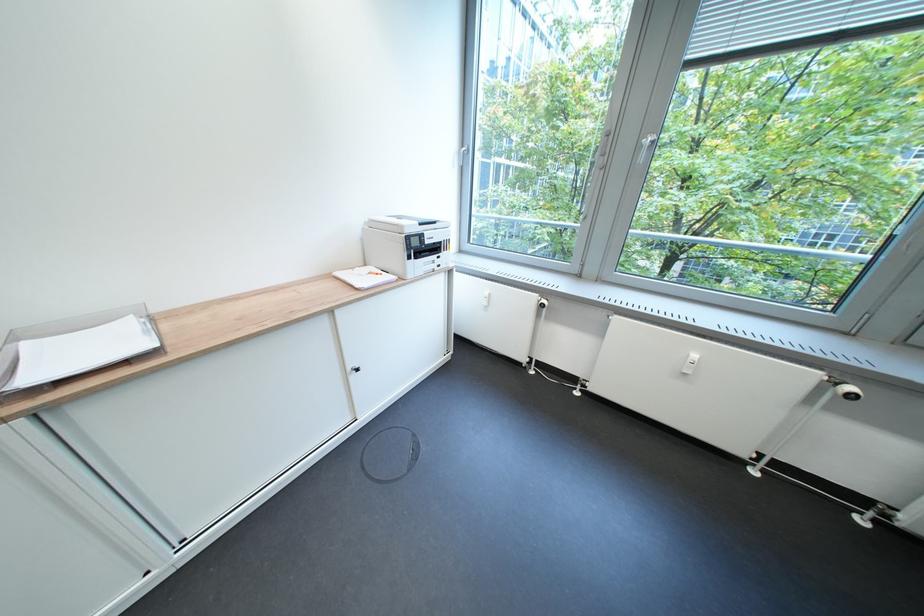
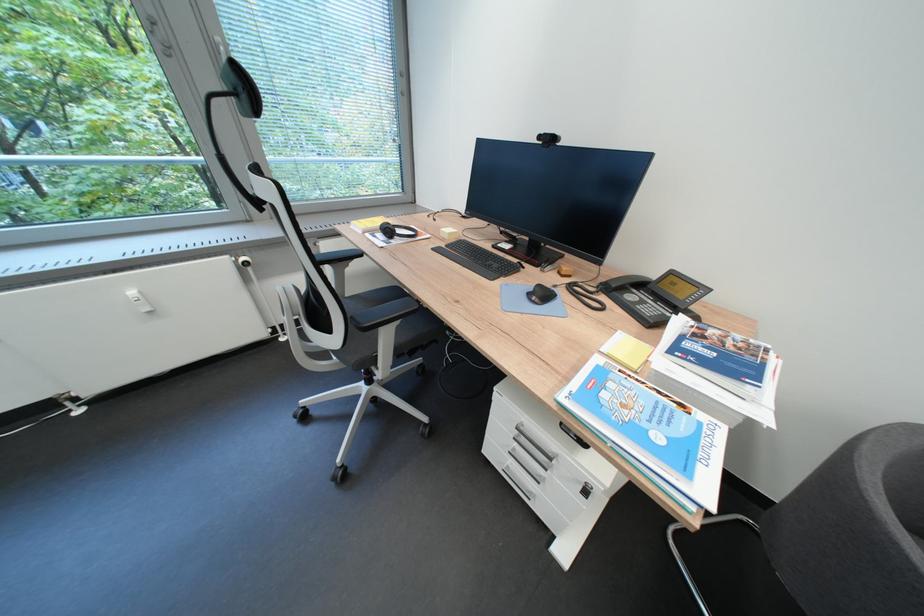
The first image is from the beginning of the video and the second image is from the end. How did the camera likely rotate when shooting the video?

The camera's rotation is toward right-down.